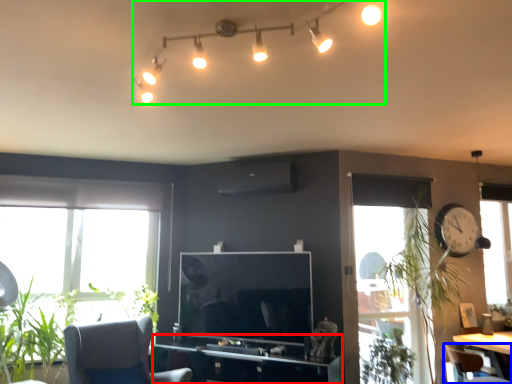
Question: Which is nearer to the computer desk (highlighted by a red box)? chair (highlighted by a blue box) or light fixture (highlighted by a green box).

Choices:
 (A) chair
 (B) light fixture

Answer: (A)